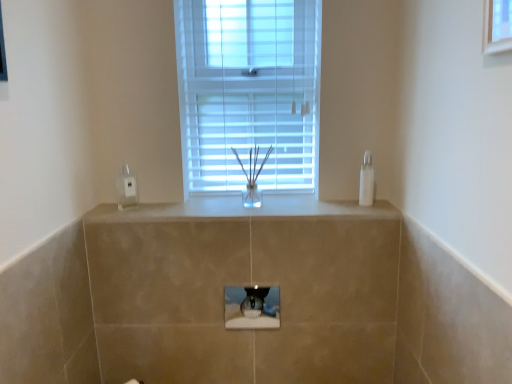
The image size is (512, 384). In order to click on white plastic window at center in this screenshot , I will do `click(249, 93)`.

Find the location of `transparent plastic soap dispenser at right`. transparent plastic soap dispenser at right is located at coordinates (366, 181).

Between transparent plastic soap dispenser at right and clear plastic electric outlet at left, which one has larger size?

Bigger between the two is transparent plastic soap dispenser at right.

Which of these two, transparent plastic soap dispenser at right or clear plastic electric outlet at left, is wider?

Wider between the two is transparent plastic soap dispenser at right.

Is transparent plastic soap dispenser at right not near clear plastic electric outlet at left?

No, transparent plastic soap dispenser at right is not far away from clear plastic electric outlet at left.

Between white glossy counter top at center and white plastic window at center, which one appears on the left side from the viewer's perspective?

white glossy counter top at center.

Looking at this image, from a real-world perspective, which object stands above the other?

In real-world perspective, white plastic window at center is above.

Is white glossy counter top at center taller than white plastic window at center?

No.

Which object is wider, white glossy counter top at center or clear plastic electric outlet at left?

With larger width is white glossy counter top at center.

Is white glossy counter top at center oriented towards clear plastic electric outlet at left?

No, white glossy counter top at center is not oriented towards clear plastic electric outlet at left.

Where is `electric outlet behind the white glossy counter top at center`? The image size is (512, 384). electric outlet behind the white glossy counter top at center is located at coordinates (126, 189).

Is white glossy counter top at center far away from clear plastic electric outlet at left?

No.

From the image's perspective, who appears lower, clear plastic electric outlet at left or white plastic window at center?

clear plastic electric outlet at left, from the image's perspective.

Which point is more forward, (124,180) or (212,158)?

Point (124,180)

The image size is (512, 384). I want to click on window above the clear plastic electric outlet at left (from the image's perspective), so click(x=249, y=93).

Who is taller, white plastic window at center or white glossy counter top at center?

white plastic window at center is taller.

Which of these two, white plastic window at center or white glossy counter top at center, is wider?

white glossy counter top at center is wider.

Is white plastic window at center bigger or smaller than white glossy counter top at center?

Considering their sizes, white plastic window at center takes up more space than white glossy counter top at center.

Is white plastic window at center positioned before white glossy counter top at center?

No, it is not.

Does point (364, 194) come closer to viewer compared to point (243, 297)?

That is False.

Considering the relative sizes of transparent plastic soap dispenser at right and transparent glass hole at center in the image provided, is transparent plastic soap dispenser at right shorter than transparent glass hole at center?

No.

Which of these two, transparent plastic soap dispenser at right or transparent glass hole at center, is wider?

transparent plastic soap dispenser at right.

From the image's perspective, which object appears higher, transparent plastic soap dispenser at right or transparent glass hole at center?

transparent plastic soap dispenser at right appears higher in the image.

Is transparent glass hole at center looking in the opposite direction of clear plastic electric outlet at left?

That's not correct — transparent glass hole at center is not looking away from clear plastic electric outlet at left.

Would you say transparent glass hole at center is a long distance from clear plastic electric outlet at left?

No, transparent glass hole at center is in close proximity to clear plastic electric outlet at left.

Measure the distance from transparent glass hole at center to clear plastic electric outlet at left.

The distance of transparent glass hole at center from clear plastic electric outlet at left is 23.05 inches.

From their relative heights in the image, would you say transparent glass hole at center is taller or shorter than clear plastic electric outlet at left?

Clearly, transparent glass hole at center is shorter compared to clear plastic electric outlet at left.

Locate an element on the screen. soap dispenser above the clear plastic electric outlet at left (from the image's perspective) is located at coordinates (366, 181).

At what (x,y) coordinates should I click in order to perform the action: click on counter top below the white plastic window at center (from a real-world perspective). Please return your answer as a coordinate pair (x, y). The image size is (512, 384). Looking at the image, I should click on (240, 209).

Considering their positions, is clear plastic electric outlet at left positioned further to white glossy counter top at center than transparent glass hole at center?

clear plastic electric outlet at left is positioned further to the anchor white glossy counter top at center.

From the image, which object appears to be nearer to transparent glass hole at center, white glossy counter top at center or clear plastic electric outlet at left?

white glossy counter top at center.

Estimate the real-world distances between objects in this image. Which object is further from white plastic window at center, white glossy counter top at center or transparent glass hole at center?

The object further to white plastic window at center is transparent glass hole at center.

Considering their positions, is white glossy counter top at center positioned further to clear plastic electric outlet at left than transparent plastic soap dispenser at right?

transparent plastic soap dispenser at right is positioned further to the anchor clear plastic electric outlet at left.

Looking at the image, which one is located closer to transparent glass hole at center, clear plastic electric outlet at left or transparent plastic soap dispenser at right?

transparent plastic soap dispenser at right.

Looking at the image, which one is located further to clear plastic electric outlet at left, transparent glass hole at center or white glossy counter top at center?

Among the two, transparent glass hole at center is located further to clear plastic electric outlet at left.

Based on their spatial positions, is clear plastic electric outlet at left or white glossy counter top at center closer to transparent plastic soap dispenser at right?

white glossy counter top at center.

Based on their spatial positions, is clear plastic electric outlet at left or transparent glass hole at center further from transparent plastic soap dispenser at right?

clear plastic electric outlet at left lies further to transparent plastic soap dispenser at right than the other object.

The image size is (512, 384). Find the location of `counter top located between clear plastic electric outlet at left and transparent glass hole at center in the left-right direction`. counter top located between clear plastic electric outlet at left and transparent glass hole at center in the left-right direction is located at coordinates [240, 209].

The image size is (512, 384). What are the coordinates of `counter top situated between clear plastic electric outlet at left and white plastic window at center from left to right` in the screenshot? It's located at (240, 209).

Identify the location of counter top situated between clear plastic electric outlet at left and transparent plastic soap dispenser at right from left to right. The width and height of the screenshot is (512, 384). (240, 209).

In order to click on hole between white glossy counter top at center and transparent plastic soap dispenser at right in the horizontal direction in this screenshot , I will do `click(252, 307)`.